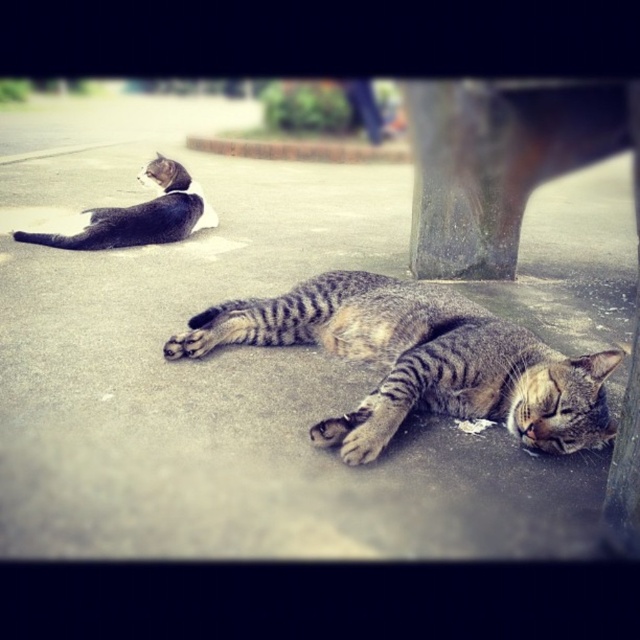
Is point (205, 186) positioned in front of point (385, 406)?

No, (205, 186) is behind (385, 406).

Is gray concrete pavement at center taller than striped fur cat at center?

Yes.

What do you see at coordinates (224, 368) in the screenshot?
I see `gray concrete pavement at center` at bounding box center [224, 368].

Find the location of a particular element. Image resolution: width=640 pixels, height=640 pixels. gray concrete pavement at center is located at coordinates (224, 368).

Is striped fur cat at center behind striped fur cat at upper left?

No, striped fur cat at center is closer to the viewer.

Image resolution: width=640 pixels, height=640 pixels. What do you see at coordinates (419, 360) in the screenshot?
I see `striped fur cat at center` at bounding box center [419, 360].

I want to click on striped fur cat at center, so click(419, 360).

Can you confirm if gray concrete pavement at center is smaller than striped fur cat at upper left?

Incorrect, gray concrete pavement at center is not smaller in size than striped fur cat at upper left.

Between point (118, 404) and point (196, 216), which one is positioned behind?

Point (196, 216)

Where is `gray concrete pavement at center`? This screenshot has height=640, width=640. gray concrete pavement at center is located at coordinates (224, 368).